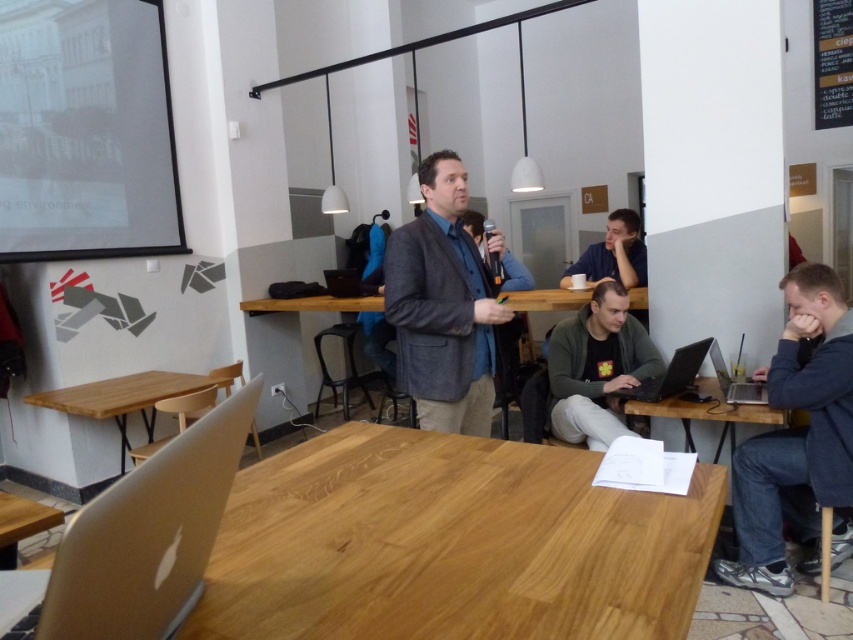
Can you confirm if dark blue shirt at upper right is smaller than silver metallic laptop at lower right?

Actually, dark blue shirt at upper right might be larger than silver metallic laptop at lower right.

Is point (645, 260) positioned before point (712, 355)?

No.

Is point (625, 221) closer to camera compared to point (717, 378)?

No, it is not.

Identify the location of dark blue shirt at upper right. Image resolution: width=853 pixels, height=640 pixels. (613, 253).

Who is more distant from viewer, [637,355] or [564,308]?

The point [564,308] is behind.

Who is more forward, (611, 408) or (524, 292)?

Point (611, 408)

Identify the location of dark green sweater at center. (596, 368).

Is point (195, 451) positioned in front of point (334, 288)?

Yes.

Between silver metallic laptop at lower left and black matte laptop at center, which one is positioned lower?

Positioned lower is silver metallic laptop at lower left.

The width and height of the screenshot is (853, 640). I want to click on silver metallic laptop at lower left, so click(148, 536).